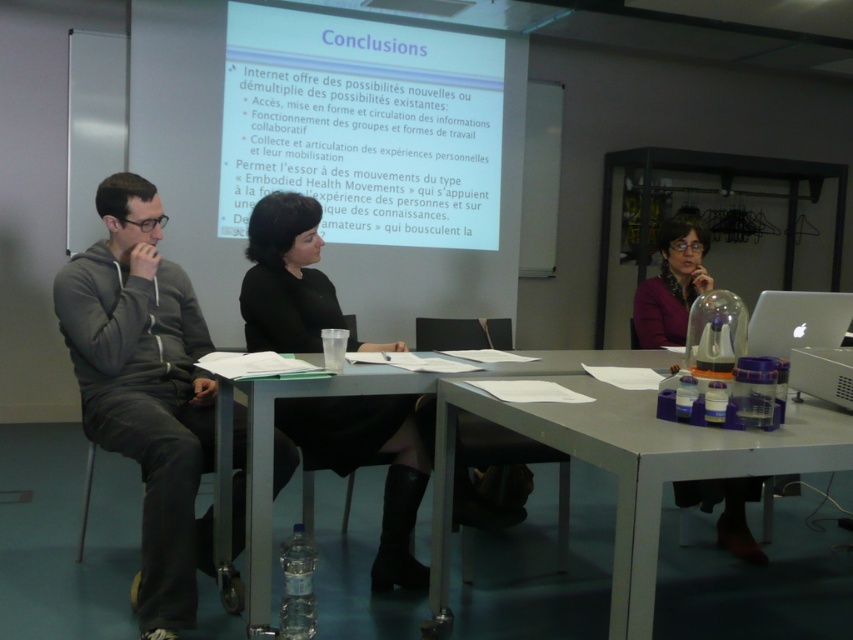
Question: Can you confirm if metallic gray table at lower right is positioned below purple matte jacket at center?

Choices:
 (A) yes
 (B) no

Answer: (A)

Question: Which of the following is the farthest from the observer?

Choices:
 (A) black leather skirt at center
 (B) gray hoodie at left
 (C) metallic gray table at center
 (D) white matte projector screen at upper center

Answer: (D)

Question: Which point is farther to the camera?

Choices:
 (A) (705, 273)
 (B) (292, 193)

Answer: (A)

Question: Which point appears closest to the camera in this image?

Choices:
 (A) (448, 106)
 (B) (743, 552)
 (C) (289, 256)
 (D) (253, 612)

Answer: (D)

Question: Does purple matte jacket at center have a greater width compared to white plastic projector at lower right?

Choices:
 (A) yes
 (B) no

Answer: (A)

Question: Does white matte projector screen at upper center have a smaller size compared to metallic gray table at center?

Choices:
 (A) yes
 (B) no

Answer: (B)